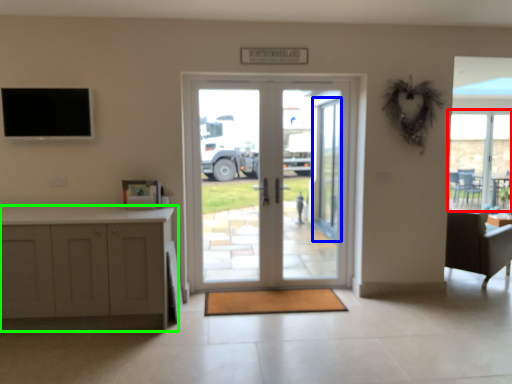
Question: Which is farther away from window (highlighted by a red box)? screen door (highlighted by a blue box) or cabinetry (highlighted by a green box)?

Choices:
 (A) screen door
 (B) cabinetry

Answer: (B)